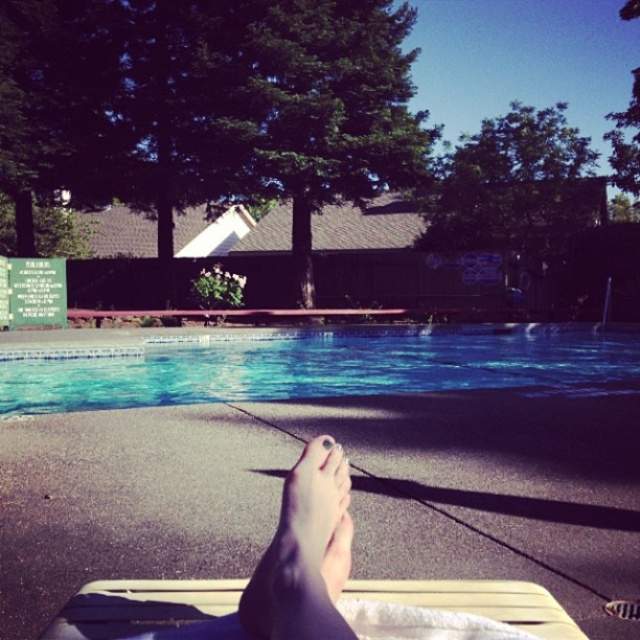
Which is below, wooden bench at lower center or pale skin at center?

wooden bench at lower center

The image size is (640, 640). What do you see at coordinates (140, 605) in the screenshot?
I see `wooden bench at lower center` at bounding box center [140, 605].

Is point (493, 582) positioned in front of point (275, 637)?

No, (493, 582) is further to viewer.

You are a GUI agent. You are given a task and a screenshot of the screen. Output one action in this format:
    pyautogui.click(x=<x>, y=<y>)
    Task: Click on the wooden bench at lower center
    
    Given the screenshot: What is the action you would take?
    pyautogui.click(x=140, y=605)

Does pale skin at center have a smaller size compared to matte skin toe at center?

Actually, pale skin at center might be larger than matte skin toe at center.

I want to click on pale skin at center, so click(305, 554).

Describe the element at coordinates (305, 554) in the screenshot. I see `pale skin at center` at that location.

You are a GUI agent. You are given a task and a screenshot of the screen. Output one action in this format:
    pyautogui.click(x=<x>, y=<y>)
    Task: Click on the pale skin at center
    The image size is (640, 640).
    Given the screenshot: What is the action you would take?
    pyautogui.click(x=305, y=554)

Which of these two, clear blue water at center or matte skin toe at center, stands taller?

clear blue water at center is taller.

Does clear blue water at center have a larger size compared to matte skin toe at center?

Yes.

Find the location of a particular element. The height and width of the screenshot is (640, 640). clear blue water at center is located at coordinates (320, 365).